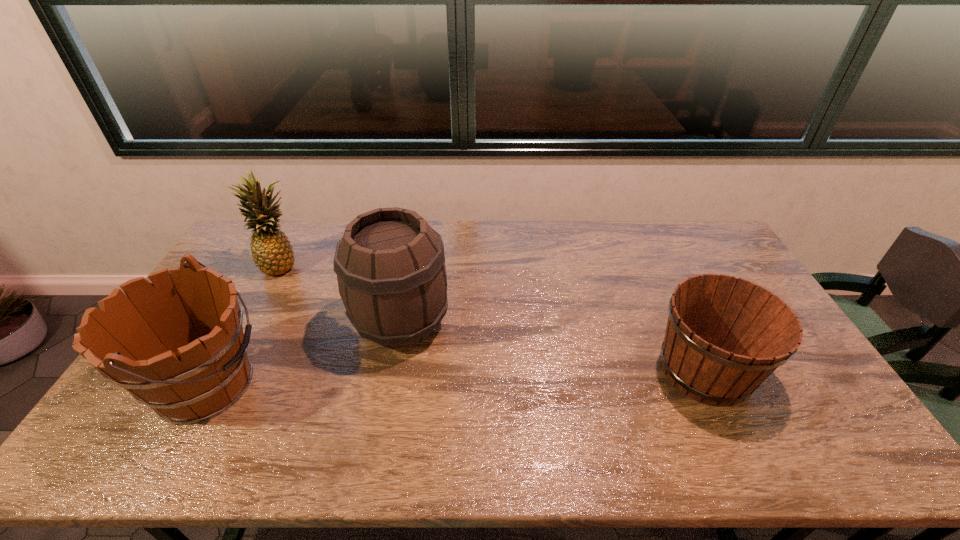
Locate an element on the screen. free area in between the leftmost wine bucket and the shortest object is located at coordinates (456, 378).

Find the location of a particular element. empty space that is in between the leftmost wine bucket and the shortest object is located at coordinates (456, 378).

The width and height of the screenshot is (960, 540). In order to click on unoccupied position between the second wine bucket from right to left and the shortest wine bucket in this screenshot , I will do `click(553, 346)`.

Where is `vacant area that lies between the leftmost wine bucket and the second wine bucket from right to left`? The height and width of the screenshot is (540, 960). vacant area that lies between the leftmost wine bucket and the second wine bucket from right to left is located at coordinates (304, 354).

This screenshot has height=540, width=960. Find the location of `vacant space that's between the rightmost object and the second wine bucket from right to left`. vacant space that's between the rightmost object and the second wine bucket from right to left is located at coordinates (553, 346).

Locate an element on the screen. This screenshot has height=540, width=960. vacant region between the leftmost wine bucket and the rightmost wine bucket is located at coordinates (456, 378).

At what (x,y) coordinates should I click in order to perform the action: click on free space that is in between the farthest object and the shortest object. Please return your answer as a coordinate pair (x, y). Looking at the image, I should click on (493, 318).

Where is `vacant area between the second wine bucket from left to right and the leftmost wine bucket`? The width and height of the screenshot is (960, 540). vacant area between the second wine bucket from left to right and the leftmost wine bucket is located at coordinates (304, 354).

In order to click on empty space between the pineapple and the shortest wine bucket in this screenshot , I will do (493, 318).

Point out which object is positioned as the third nearest to the third object from left to right. Please provide its 2D coordinates. Your answer should be formatted as a tuple, i.e. [(x, y)], where the tuple contains the x and y coordinates of a point satisfying the conditions above.

[(725, 335)]